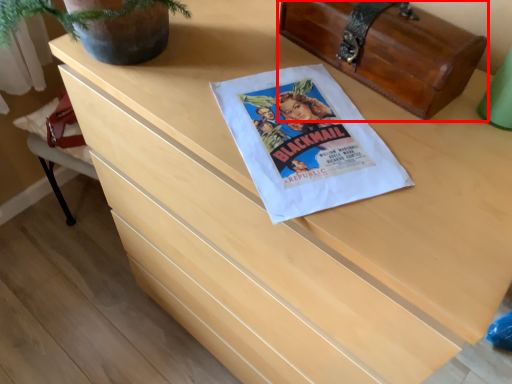
Question: From the image's perspective, where is chest (annotated by the red box) located in relation to flyer in the image?

Choices:
 (A) below
 (B) above

Answer: (B)